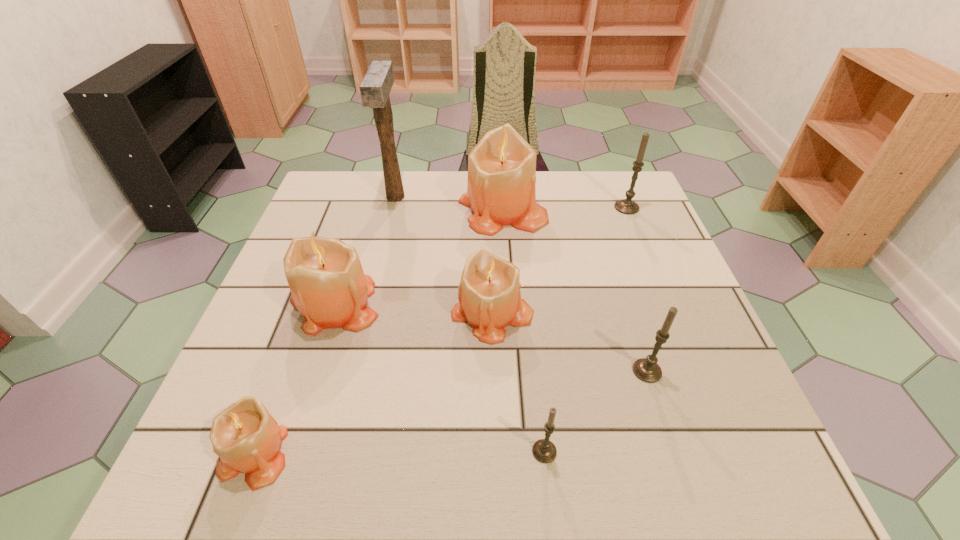
Locate an element on the screen. This screenshot has width=960, height=540. the smallest beige candle is located at coordinates (246, 437).

I want to click on vacant space located on the front of the mallet, so click(365, 323).

What are the coordinates of `vacant region located on the right of the biggest beige candle` in the screenshot? It's located at pos(568,211).

Where is `vacant space situated 0.150m on the left of the rightmost object`? vacant space situated 0.150m on the left of the rightmost object is located at coordinates (561, 207).

This screenshot has width=960, height=540. Find the location of `free spot located on the back of the third smallest beige candle`. free spot located on the back of the third smallest beige candle is located at coordinates 355,241.

This screenshot has width=960, height=540. Find the location of `vacant space located on the right of the second gray candle from left to right`. vacant space located on the right of the second gray candle from left to right is located at coordinates (687, 371).

Image resolution: width=960 pixels, height=540 pixels. Identify the location of free space located on the back of the third biggest beige candle. (490, 207).

Image resolution: width=960 pixels, height=540 pixels. Find the location of `vacant area situated 0.380m on the left of the nearest gray candle`. vacant area situated 0.380m on the left of the nearest gray candle is located at coordinates (303, 451).

Locate an element on the screen. This screenshot has height=540, width=960. free space located 0.380m on the back of the nearest beige candle is located at coordinates (324, 272).

Identify the location of mallet that is at the far edge. (375, 88).